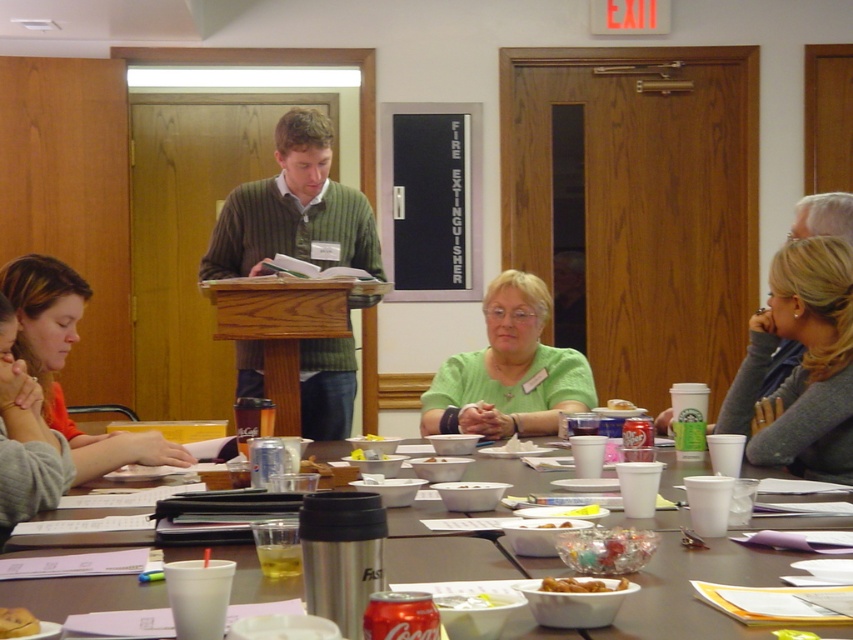
Between matte green shirt at center and translucent plastic cup at center, which one has less height?

Standing shorter between the two is translucent plastic cup at center.

Is matte green shirt at center above translucent plastic cup at center?

Correct, matte green shirt at center is located above translucent plastic cup at center.

Between point (33, 285) and point (633, 406), which one is positioned behind?

The point (633, 406) is behind.

I want to click on matte green shirt at center, so click(64, 362).

Does white matte bowl at center appear under translucent plastic cup at center?

Yes.

I want to click on white matte bowl at center, so click(x=368, y=454).

Is point (376, 452) closer to viewer compared to point (611, 403)?

Yes.

The height and width of the screenshot is (640, 853). Identify the location of white matte bowl at center. (368, 454).

Who is shorter, metallic silver thermos at center or green matte shirt at center?

metallic silver thermos at center

Can you confirm if metallic silver thermos at center is shorter than green matte shirt at center?

Correct, metallic silver thermos at center is not as tall as green matte shirt at center.

At what (x,y) coordinates should I click in order to perform the action: click on metallic silver thermos at center. Please return your answer as a coordinate pair (x, y). Image resolution: width=853 pixels, height=640 pixels. Looking at the image, I should click on pyautogui.click(x=689, y=586).